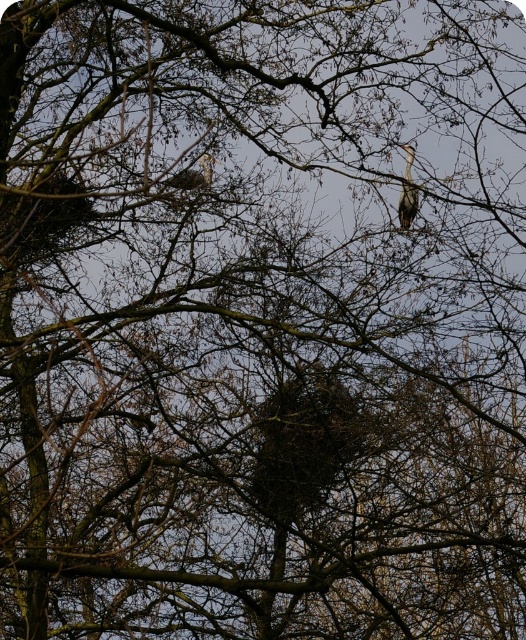
Which is in front, point (403, 225) or point (169, 182)?

Point (403, 225)

In the scene shown: Who is more distant from viewer, (404, 225) or (208, 186)?

Positioned behind is point (208, 186).

Identify the location of gray feathered bird at upper right. Image resolution: width=526 pixels, height=640 pixels. (408, 193).